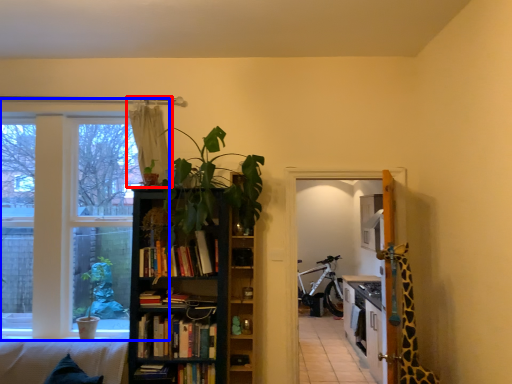
Question: Which object is closer to the camera taking this photo, curtain (highlighted by a red box) or window (highlighted by a blue box)?

Choices:
 (A) curtain
 (B) window

Answer: (A)